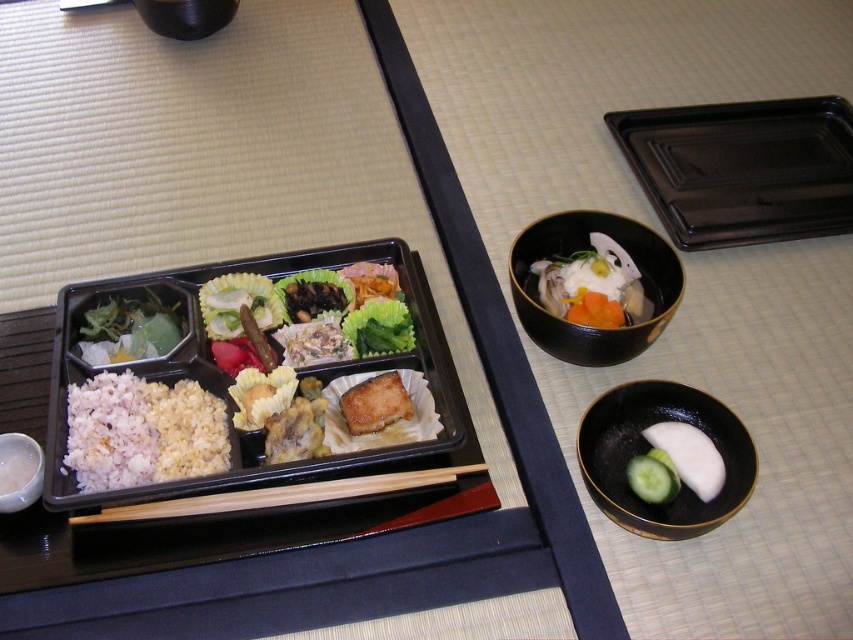
Is black plastic tray at upper right bigger than black ceramic bowl at upper right?

Correct, black plastic tray at upper right is larger in size than black ceramic bowl at upper right.

Which is above, black plastic tray at upper right or black ceramic bowl at upper right?

black plastic tray at upper right

Does point (717, 193) come in front of point (560, 352)?

No, it is behind (560, 352).

Identify the location of black plastic tray at upper right. The width and height of the screenshot is (853, 640). (743, 168).

Between black plastic tray at upper right and green leafy vegetable at center, which one is positioned lower?

green leafy vegetable at center is below.

Which is more to the right, black plastic tray at upper right or green leafy vegetable at center?

Positioned to the right is black plastic tray at upper right.

Is point (720, 154) closer to camera compared to point (402, 330)?

No, (720, 154) is behind (402, 330).

Where is `black plastic tray at upper right`? black plastic tray at upper right is located at coordinates (743, 168).

Based on the photo, who is shorter, white matte rice at left or white smooth radish at lower right?

With less height is white smooth radish at lower right.

In the scene shown: Which is above, white matte rice at left or white smooth radish at lower right?

white matte rice at left is higher up.

Which is behind, point (125, 468) or point (712, 468)?

Point (125, 468)

Image resolution: width=853 pixels, height=640 pixels. What are the coordinates of `white matte rice at left` in the screenshot? It's located at (142, 432).